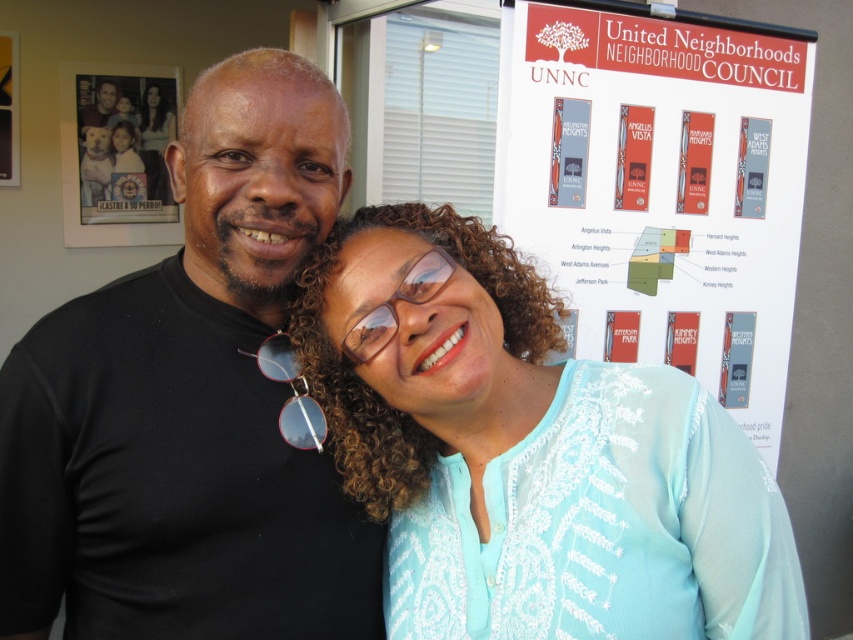
You are a photographer adjusting your camera settings. You notice the light blue embroidered blouse at center and the transparent plastic glasses at center in the frame. Which object should you focus on to ensure it appears sharp if the other might be slightly out of focus due to limited depth of field?

The light blue embroidered blouse at center is closer to the viewer than the transparent plastic glasses at center, so focusing on the light blue embroidered blouse at center will ensure it is sharp while the glasses may be slightly blurred.

You are a photographer taking a picture of the UNNC poster board. You notice two points marked on the board at coordinates point (560, 273) and point (312, 428). Which point is closer to the camera?

Point (560, 273) is further to the camera than point (312, 428), so the point closer to the camera is point (312, 428).

You are a photographer adjusting your camera settings to capture the perfect shot of the scene. You need to ensure that both the light blue embroidered blouse at center and the transparent plastic glasses at center are in focus. Which object should you adjust your focus on first to account for their sizes?

The light blue embroidered blouse at center is wider than the transparent plastic glasses at center, so you should focus on the light blue embroidered blouse at center first since it occupies more space in the frame.